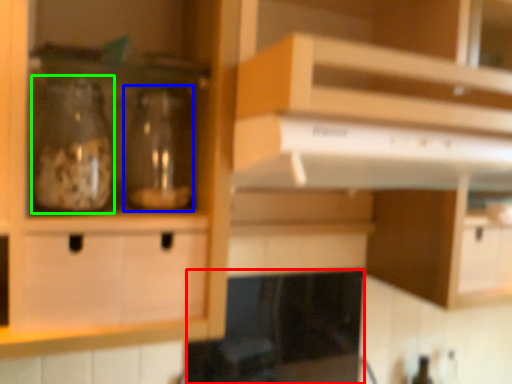
Question: Estimate the real-world distances between objects in this image. Which object is closer to appliance (highlighted by a red box), glass bottle (highlighted by a blue box) or glass bottle (highlighted by a green box)?

Choices:
 (A) glass bottle
 (B) glass bottle

Answer: (A)